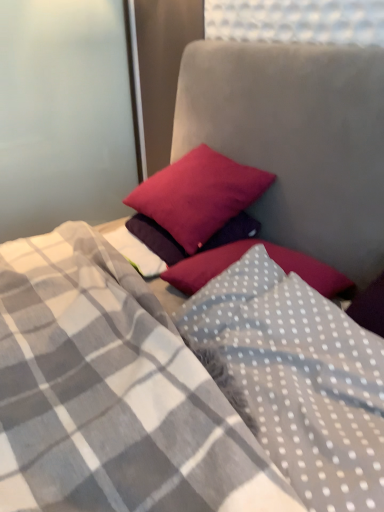
Question: In terms of width, does matte pink pillow at upper center, which is counted as the first pillow, starting from the back, look wider or thinner when compared to white dotted fabric pillow at center, which is counted as the 2th pillow, starting from the top?

Choices:
 (A) wide
 (B) thin

Answer: (B)

Question: Considering the positions of point (160, 215) and point (286, 472), is point (160, 215) closer or farther from the camera than point (286, 472)?

Choices:
 (A) farther
 (B) closer

Answer: (A)

Question: Relative to white dotted fabric pillow at center, which is the 1th pillow from bottom to top, is matte pink pillow at upper center, positioned as the first pillow in top-to-bottom order, in front or behind?

Choices:
 (A) front
 (B) behind

Answer: (B)

Question: Is white dotted fabric pillow at center, which ranks as the second pillow in back-to-front order, inside or outside of matte pink pillow at upper center, positioned as the first pillow in top-to-bottom order?

Choices:
 (A) inside
 (B) outside

Answer: (B)

Question: Is point (316, 422) positioned closer to the camera than point (201, 184)?

Choices:
 (A) closer
 (B) farther

Answer: (A)

Question: In the image, is white dotted fabric pillow at center, which is the 1th pillow from bottom to top, positioned in front of or behind matte pink pillow at upper center, which is counted as the first pillow, starting from the back?

Choices:
 (A) front
 (B) behind

Answer: (A)

Question: Is white dotted fabric pillow at center, which is counted as the 2th pillow, starting from the top, wider or thinner than matte pink pillow at upper center, the 2th pillow when ordered from bottom to top?

Choices:
 (A) thin
 (B) wide

Answer: (B)